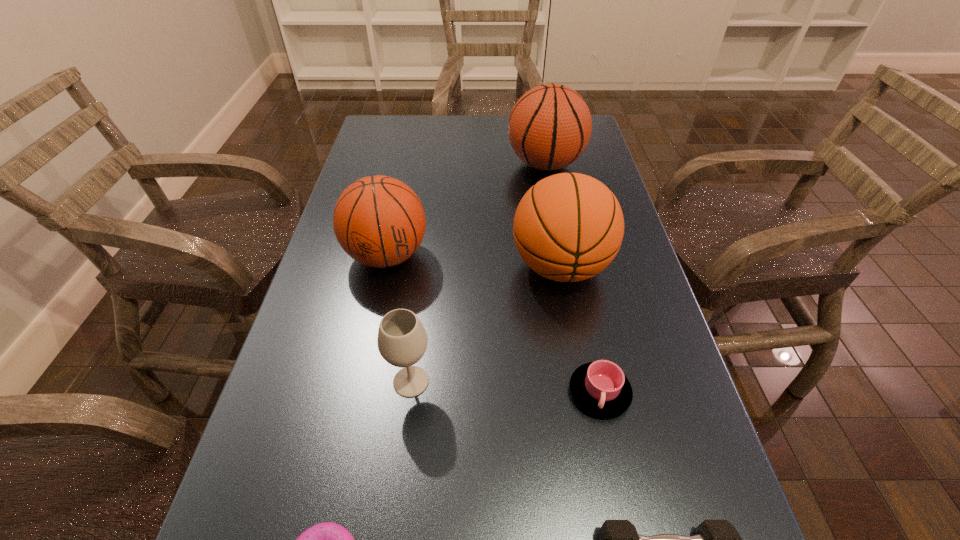
Choose which basketball is the third nearest neighbor to the shortest object. Please provide its 2D coordinates. Your answer should be formatted as a tuple, i.e. [(x, y)], where the tuple contains the x and y coordinates of a point satisfying the conditions above.

[(549, 127)]

I want to click on basketball that can be found as the third closest to the dumbbell, so click(549, 127).